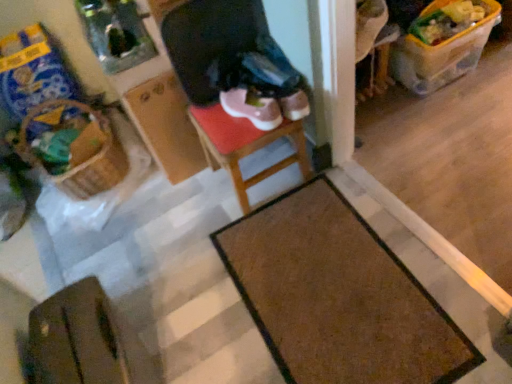
Question: Is wooden stool at center positioned beyond the bounds of brown textured mat at lower center?

Choices:
 (A) yes
 (B) no

Answer: (A)

Question: From the image's perspective, would you say wooden stool at center is shown under brown textured mat at lower center?

Choices:
 (A) yes
 (B) no

Answer: (B)

Question: Is wooden stool at center far away from brown textured mat at lower center?

Choices:
 (A) yes
 (B) no

Answer: (B)

Question: Can you confirm if wooden stool at center is positioned to the right of brown textured mat at lower center?

Choices:
 (A) no
 (B) yes

Answer: (A)

Question: Considering the relative sizes of wooden stool at center and brown textured mat at lower center in the image provided, is wooden stool at center taller than brown textured mat at lower center?

Choices:
 (A) no
 (B) yes

Answer: (B)

Question: Does wooden stool at center appear on the left side of brown textured mat at lower center?

Choices:
 (A) no
 (B) yes

Answer: (B)

Question: Would you say brown textured mat at lower center is part of brown leather wallet at lower left's contents?

Choices:
 (A) yes
 (B) no

Answer: (B)

Question: Does brown leather wallet at lower left lie in front of brown textured mat at lower center?

Choices:
 (A) no
 (B) yes

Answer: (B)

Question: From a real-world perspective, is brown leather wallet at lower left beneath brown textured mat at lower center?

Choices:
 (A) yes
 (B) no

Answer: (B)

Question: Does brown leather wallet at lower left appear on the right side of brown textured mat at lower center?

Choices:
 (A) no
 (B) yes

Answer: (A)

Question: Is brown leather wallet at lower left positioned with its back to brown textured mat at lower center?

Choices:
 (A) no
 (B) yes

Answer: (A)

Question: From the image's perspective, does brown leather wallet at lower left appear lower than brown textured mat at lower center?

Choices:
 (A) yes
 (B) no

Answer: (A)

Question: Is wooden stool at center touching brown woven basket at left?

Choices:
 (A) no
 (B) yes

Answer: (A)